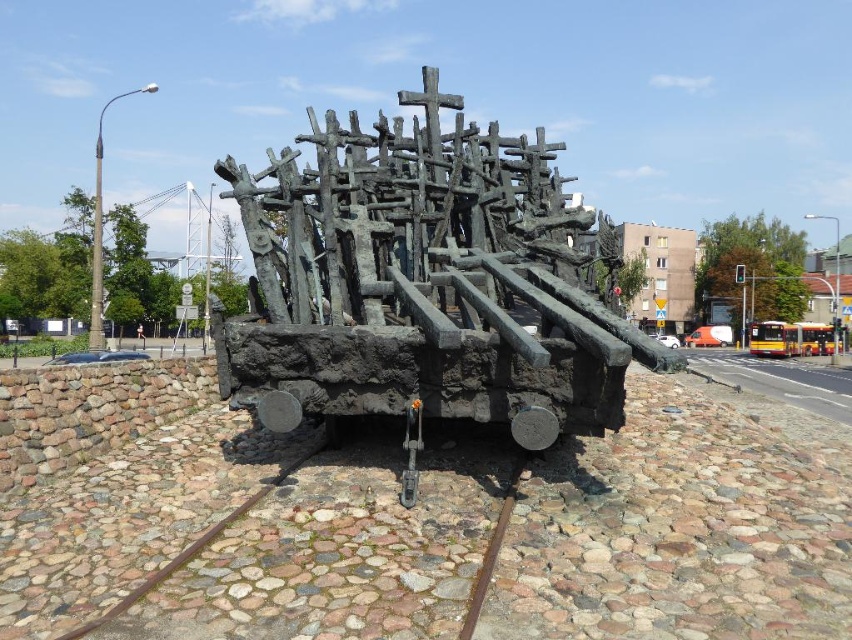
Question: Does bronze sculpture at center have a greater width compared to rusty metal train track at center?

Choices:
 (A) no
 (B) yes

Answer: (A)

Question: Estimate the real-world distances between objects in this image. Which object is farther from the brown rusty metal train track at lower center?

Choices:
 (A) rusty metal train track at center
 (B) bronze sculpture at center

Answer: (B)

Question: Does brown rusty metal train track at lower center lie behind rusty metal train track at center?

Choices:
 (A) no
 (B) yes

Answer: (B)

Question: Does bronze sculpture at center appear over brown rusty metal train track at lower center?

Choices:
 (A) yes
 (B) no

Answer: (A)

Question: Which object appears closest to the camera in this image?

Choices:
 (A) bronze sculpture at center
 (B) brown rusty metal train track at lower center
 (C) rusty metal train track at center

Answer: (C)

Question: Which of the following is the closest to the observer?

Choices:
 (A) (426, 156)
 (B) (481, 608)
 (C) (196, 552)

Answer: (B)